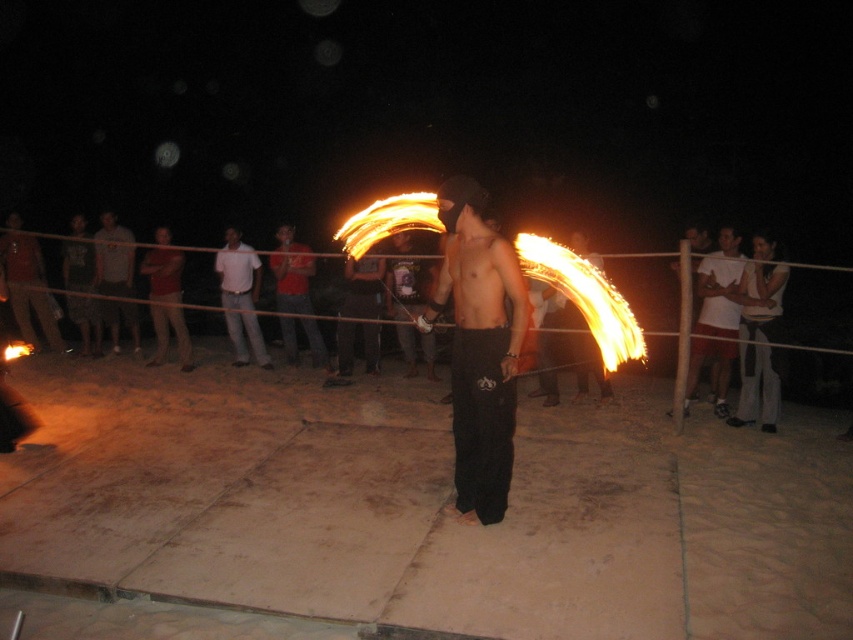
Looking at this image, you are a photographer at the fire performance. You want to capture a photo where the shiny black pants at center and the red cotton shirt at center are both visible. Which object should you focus on to ensure both are in frame?

Since the shiny black pants at center is much taller than the red cotton shirt at center, you should focus on the shiny black pants at center to ensure both are in frame as it occupies a larger portion of the scene.

You are standing at the center of the scene and want to locate the white cotton shirt at right. In which direction should you turn your head to see it?

The white cotton shirt at right is located at the right side of the scene, so you should turn your head to the right to see it.